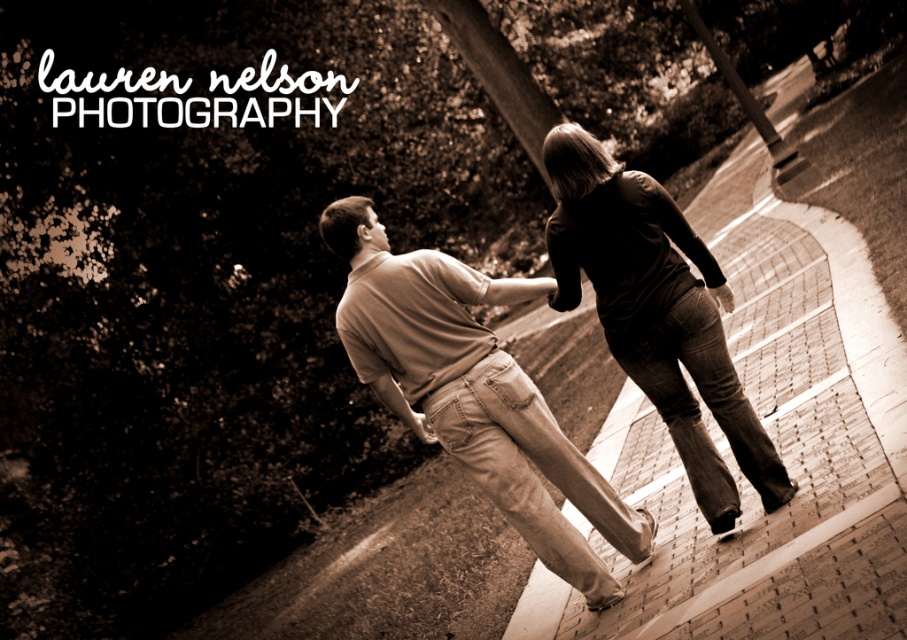
Question: Among these objects, which one is farthest from the camera?

Choices:
 (A) brick pavement at center
 (B) matte brown shirt at center

Answer: (B)

Question: Is brick pavement at center to the right of dark brown leather pants at center from the viewer's perspective?

Choices:
 (A) no
 (B) yes

Answer: (B)

Question: Which object is positioned farthest from the brick pavement at center?

Choices:
 (A) matte brown shirt at center
 (B) dark brown leather pants at center

Answer: (A)

Question: Which object is the farthest from the matte brown shirt at center?

Choices:
 (A) dark brown leather pants at center
 (B) brick pavement at center

Answer: (B)

Question: Considering the relative positions of matte brown shirt at center and dark brown leather pants at center in the image provided, where is matte brown shirt at center located with respect to dark brown leather pants at center?

Choices:
 (A) below
 (B) above

Answer: (A)

Question: Is matte brown shirt at center thinner than dark brown leather pants at center?

Choices:
 (A) yes
 (B) no

Answer: (B)